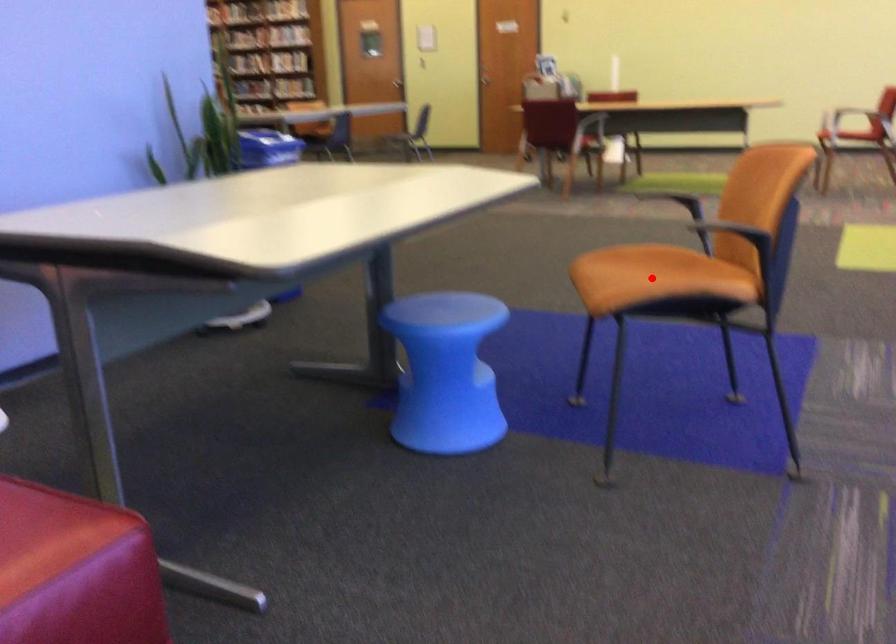
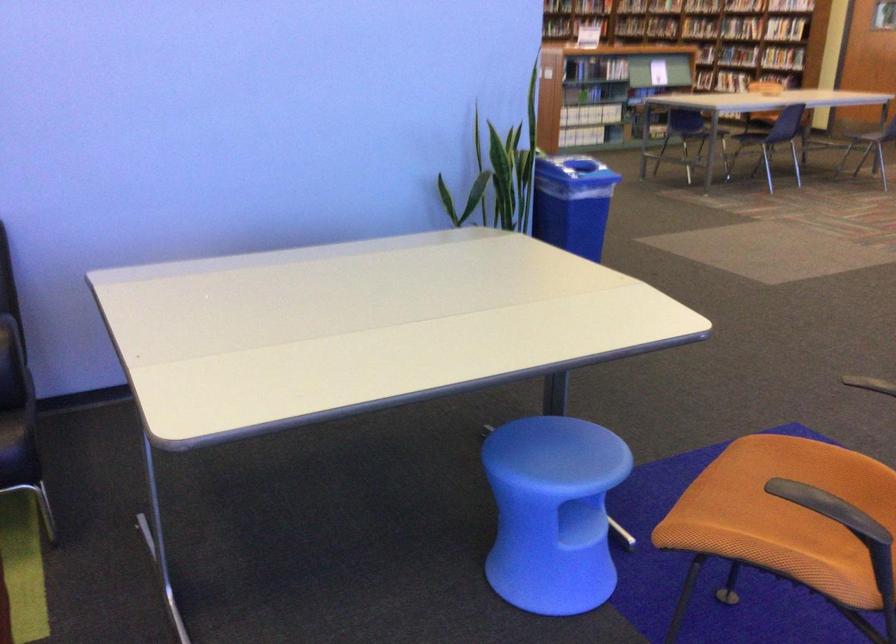
Question: I am providing you with two images of the same scene from different viewpoints. In image1, a red point is highlighted. Considering the same 3D point in image2, which of the following is correct?

Choices:
 (A) It is closer
 (B) It is farther

Answer: (A)